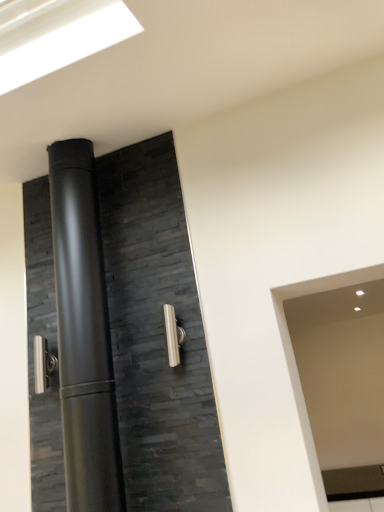
Question: Is satin nickel door handle at center, which is the 1th door handle from front to back, next to matte black door at center and touching it?

Choices:
 (A) yes
 (B) no

Answer: (B)

Question: Could you tell me if satin nickel door handle at center, placed as the 2th door handle when sorted from back to front, is facing matte black door at center?

Choices:
 (A) no
 (B) yes

Answer: (B)

Question: Is satin nickel door handle at center, the 1th door handle positioned from the right, shorter than matte black door at center?

Choices:
 (A) yes
 (B) no

Answer: (A)

Question: Does satin nickel door handle at center, the 1th door handle positioned from the right, have a lesser width compared to matte black door at center?

Choices:
 (A) yes
 (B) no

Answer: (A)

Question: Is the depth of satin nickel door handle at center, which is the 1th door handle from front to back, greater than that of matte black door at center?

Choices:
 (A) yes
 (B) no

Answer: (A)

Question: Is matte black door at center taller or shorter than satin nickel door handle at center, the 1th door handle positioned from the right?

Choices:
 (A) short
 (B) tall

Answer: (B)

Question: From the image's perspective, is matte black door at center located above or below satin nickel door handle at center, which is the 1th door handle from front to back?

Choices:
 (A) below
 (B) above

Answer: (B)

Question: From a real-world perspective, is matte black door at center above or below satin nickel door handle at center, placed as the 2th door handle when sorted from back to front?

Choices:
 (A) below
 (B) above

Answer: (B)

Question: Visually, is matte black door at center positioned to the left or to the right of satin nickel door handle at center, which is the 1th door handle from front to back?

Choices:
 (A) right
 (B) left

Answer: (B)

Question: From a real-world perspective, is matte black door at center above or below satin nickel door handle at left, the 1th door handle when ordered from back to front?

Choices:
 (A) below
 (B) above

Answer: (B)

Question: Is point (180, 368) positioned closer to the camera than point (46, 374)?

Choices:
 (A) closer
 (B) farther

Answer: (A)

Question: From the image's perspective, is matte black door at center above or below satin nickel door handle at left, which appears as the second door handle when viewed from the right?

Choices:
 (A) above
 (B) below

Answer: (A)

Question: Would you say matte black door at center is to the left or to the right of satin nickel door handle at left, placed as the first door handle when sorted from left to right, in the picture?

Choices:
 (A) right
 (B) left

Answer: (A)

Question: Based on their positions, is satin nickel door handle at left, placed as the first door handle when sorted from left to right, located to the left or right of satin nickel door handle at center, the 1th door handle positioned from the right?

Choices:
 (A) right
 (B) left

Answer: (B)

Question: Is satin nickel door handle at left, the second door handle from the front, taller or shorter than satin nickel door handle at center, which is the 1th door handle from front to back?

Choices:
 (A) short
 (B) tall

Answer: (A)